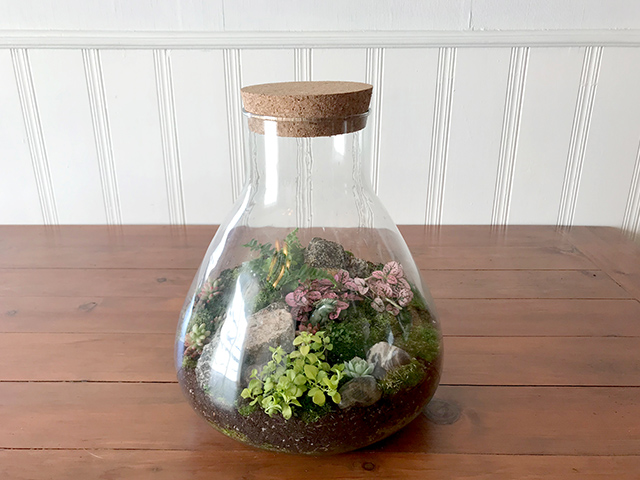
I want to click on white wall, so click(x=403, y=14).